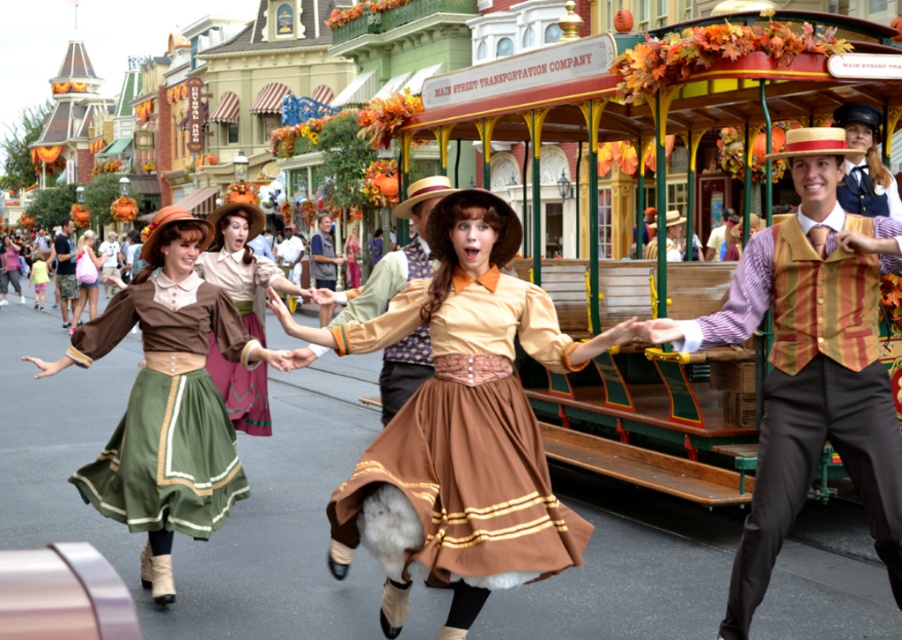
Question: From the image, what is the correct spatial relationship of green fabric skirt at left in relation to matte brown vest at left?

Choices:
 (A) left
 (B) right

Answer: (B)

Question: Can you confirm if green fabric skirt at left is bigger than matte brown vest at left?

Choices:
 (A) no
 (B) yes

Answer: (A)

Question: Which object is positioned farthest from the green fabric skirt at left?

Choices:
 (A) brown textured vest at center
 (B) matte brown dress at center

Answer: (B)

Question: Which object is farther from the camera taking this photo?

Choices:
 (A) matte brown dress at center
 (B) brown textured vest at center

Answer: (A)

Question: Is striped vest at center bigger than green fabric skirt at left?

Choices:
 (A) yes
 (B) no

Answer: (B)

Question: Estimate the real-world distances between objects in this image. Which object is closer to the green cotton skirt at center?

Choices:
 (A) matte brown vest at center
 (B) matte brown dress at center
 (C) striped vest at center

Answer: (B)